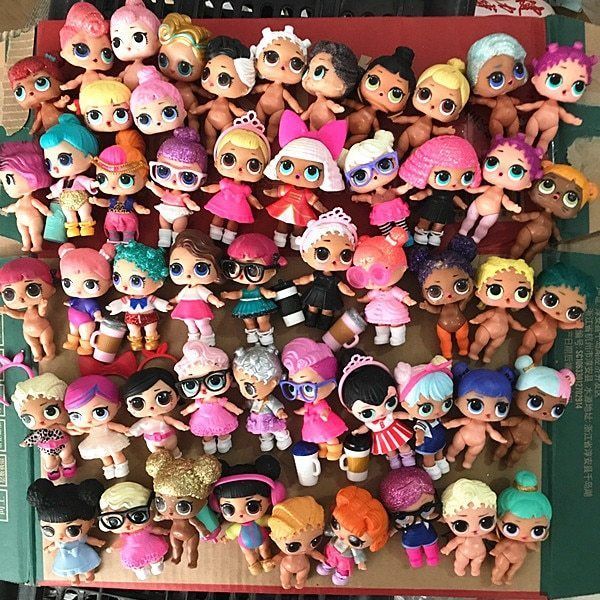
Identify the location of dolls with pink clothing. (217, 418), (325, 424), (379, 310), (226, 201), (139, 550), (399, 207), (337, 564), (424, 549), (121, 216), (79, 324).